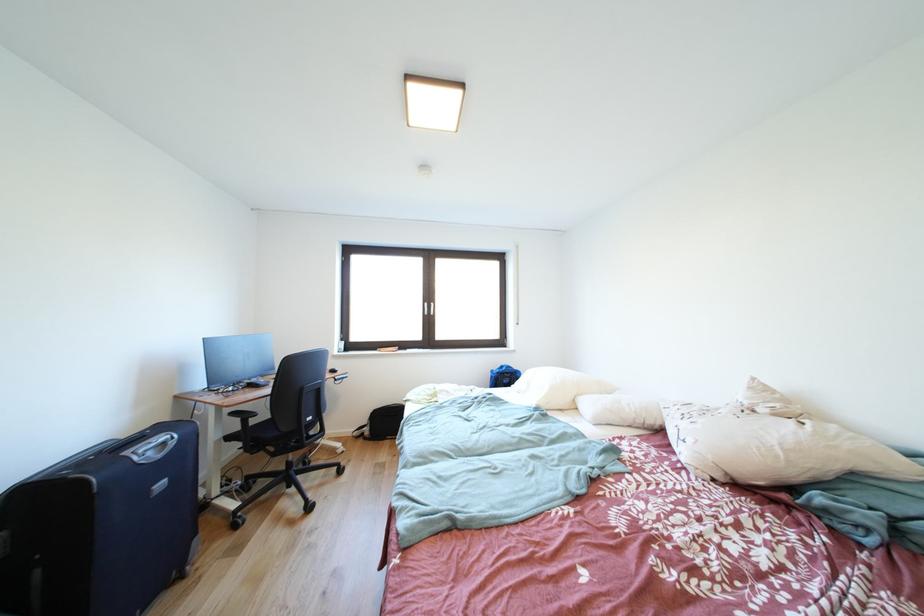
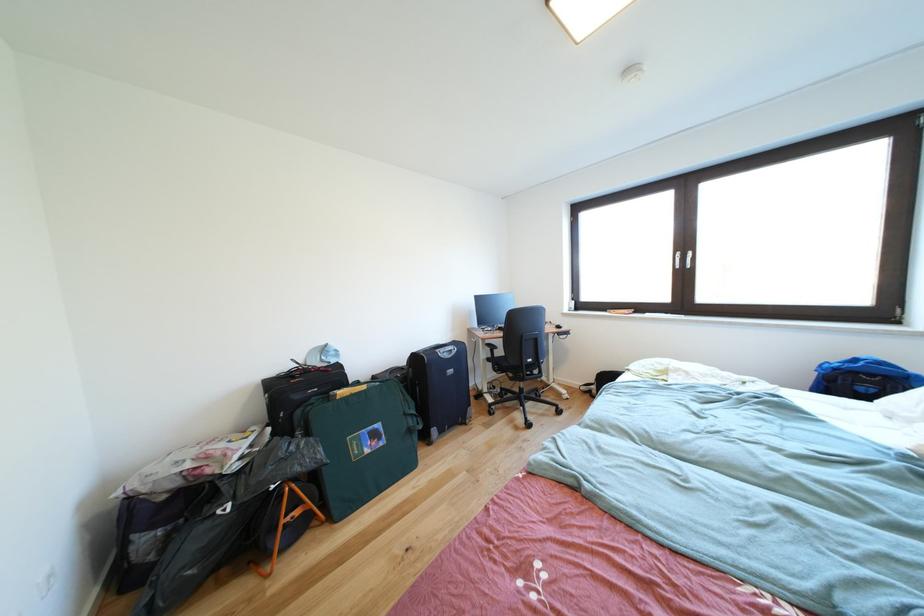
Question: How did the camera likely rotate?

Choices:
 (A) Left
 (B) Right
 (C) Up
 (D) Down

Answer: (A)